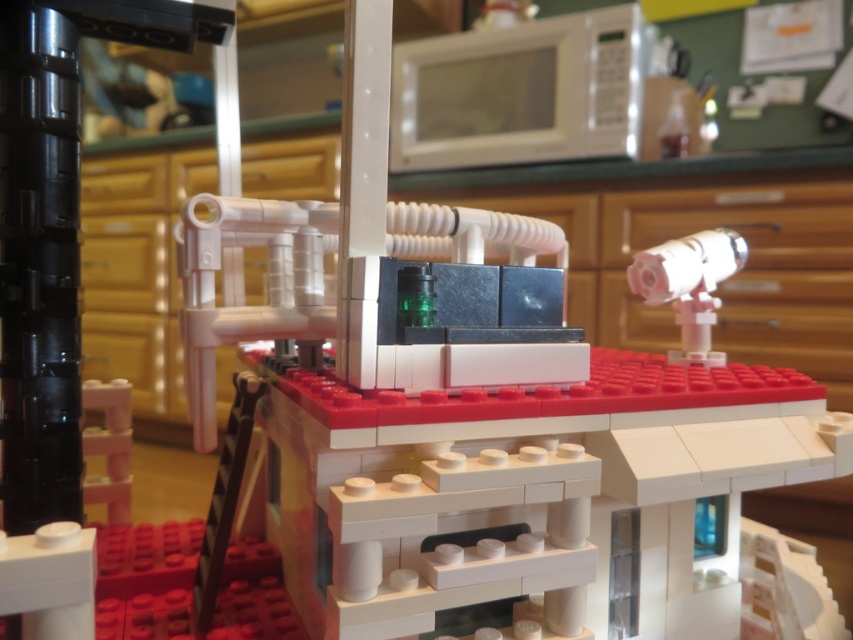
You are a delivery robot that needs to place a package between the white glossy microwave at upper center and the matte white telescope at upper right. The package is 35 inches long. Can you fit the package between them?

The distance between the white glossy microwave at upper center and the matte white telescope at upper right is 34.67 inches. Since the package is 35 inches long, it is slightly longer than the available space, so the package cannot be placed between them.

You are trying to decide whether to place a new Lego piece between the white glossy microwave at upper center and the matte white telescope at upper right. Given their sizes, which object should you position the Lego piece closer to?

The white glossy microwave at upper center is larger than the matte white telescope at upper right, so positioning the Lego piece closer to the microwave would be more appropriate as it can accommodate a larger structure.

You are a delivery person who needs to place a small package between the white glossy microwave at upper center and the matte white telescope at upper right. Which object should you position the package closer to so that it doesn

The white glossy microwave at upper center is taller than the matte white telescope at upper right. To place the package between them, position it closer to the matte white telescope at upper right since the microwave takes up more vertical space.